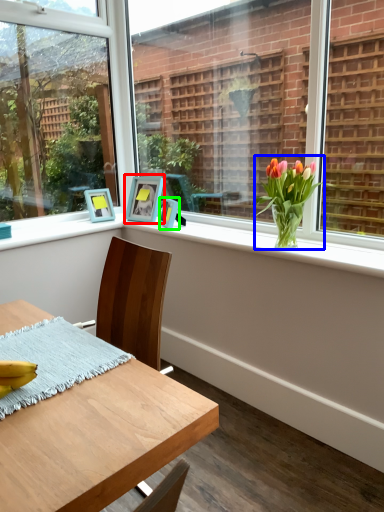
Question: Which is nearer to the picture frame (highlighted by a red box)? houseplant (highlighted by a blue box) or picture frame (highlighted by a green box).

Choices:
 (A) houseplant
 (B) picture frame

Answer: (B)